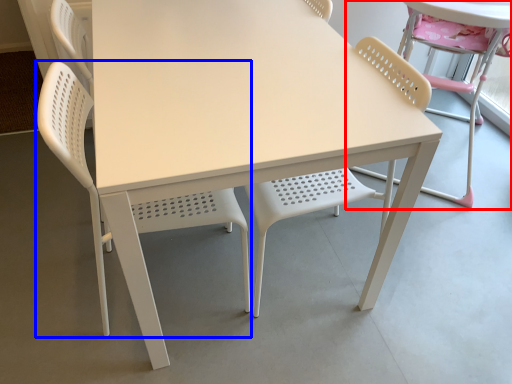
Question: Which object is further to the camera taking this photo, chair (highlighted by a red box) or chair (highlighted by a blue box)?

Choices:
 (A) chair
 (B) chair

Answer: (A)